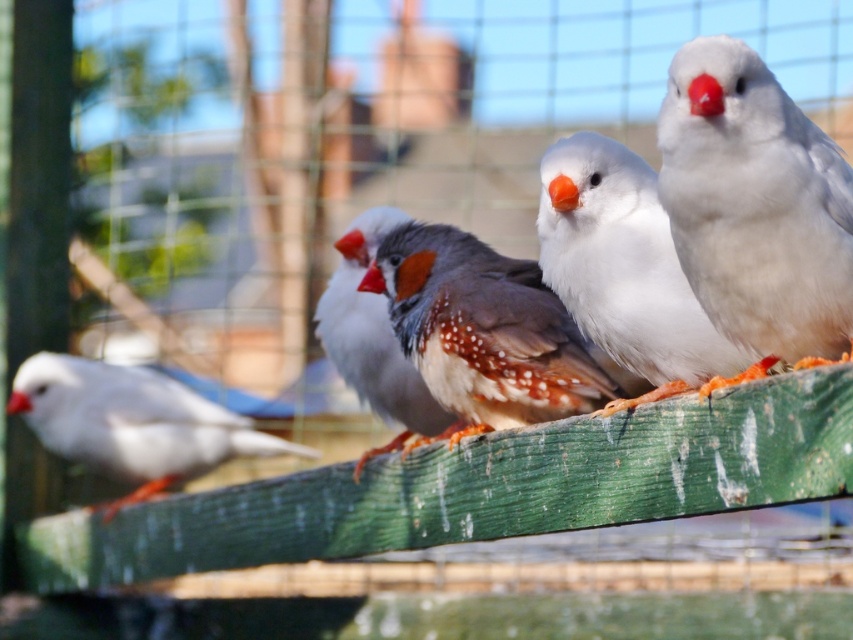
Question: Which point is closer to the camera?

Choices:
 (A) speckled feathered bird at center
 (B) white matte bird at left
 (C) white matte bird at right

Answer: (C)

Question: Where is speckled brown bird at center located in relation to white matte bird at left in the image?

Choices:
 (A) above
 (B) below

Answer: (A)

Question: Among these points, which one is nearest to the camera?

Choices:
 (A) (77, 408)
 (B) (660, 196)
 (C) (497, 344)
 (D) (676, 369)

Answer: (B)

Question: Which of the following is the farthest from the observer?

Choices:
 (A) white matte bird at right
 (B) speckled brown bird at center
 (C) white matte bird at left
 (D) white speckled bird at center

Answer: (C)

Question: Is speckled brown bird at center bigger than speckled feathered bird at center?

Choices:
 (A) yes
 (B) no

Answer: (A)

Question: From the image, what is the correct spatial relationship of white matte bird at right in relation to speckled feathered bird at center?

Choices:
 (A) below
 (B) above

Answer: (B)